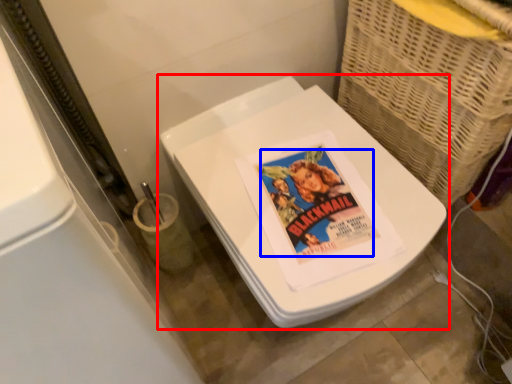
Question: Among these objects, which one is nearest to the camera, toilet (highlighted by a red box) or comic book character (highlighted by a blue box)?

Choices:
 (A) toilet
 (B) comic book character

Answer: (A)